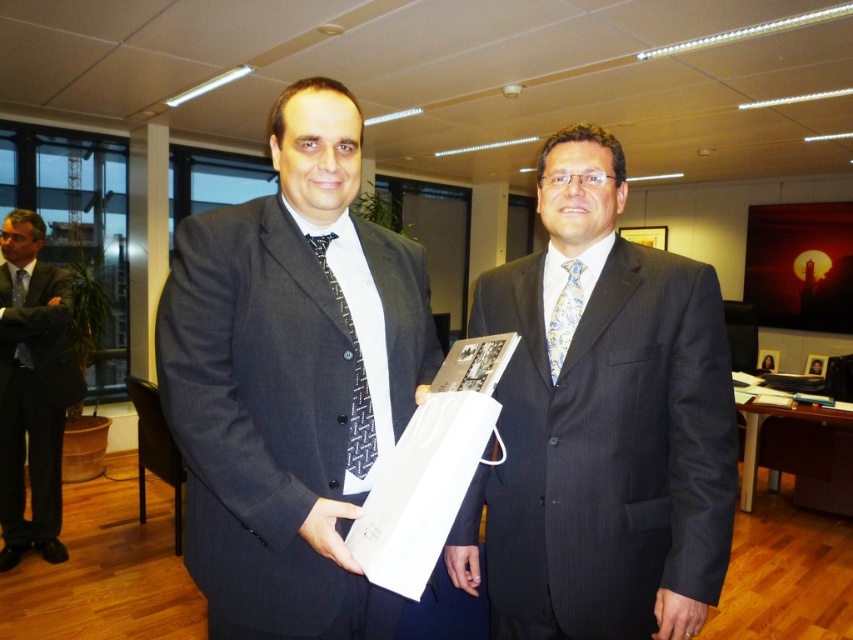
Based on the photo, please look at the image. There is a point at coordinate [291,380]. Which object in the scene does this point correspond to?

The point at coordinate [291,380] corresponds to the dark gray suit at center.

You are organizing a formal event and need to know which tie is shorter between the black textured tie at center and the matte black tie at left. Based on the scene, which one should you choose?

The black textured tie at center is not as tall as the matte black tie at left, so you should choose the black textured tie at center as it is shorter.

You are organizing a formal event and need to arrange two ties for display. The ties are the black textured tie at center and the matte black tie at left. Based on their positions in the image, which tie is located to the right of the other?

The black textured tie at center is positioned on the right side of matte black tie at left, so the black textured tie at center is to the right of the matte black tie at left.